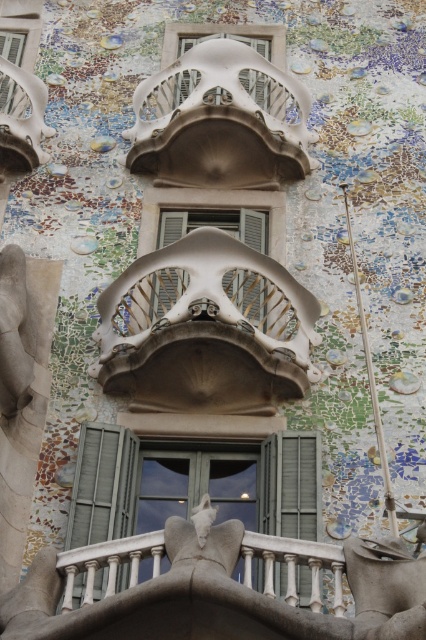
You are standing in front of Casa Batll? at Barcelona and want to take a photo of the point at coordinate point (83, 460). If your camera can only focus on objects within 50 meters, will you be able to capture the point clearly?

The point at coordinate point (83, 460) is 57.75 meters away from the camera, which is beyond the camera focus range of 50 meters. Therefore, the point cannot be captured clearly.

You are an architect visiting Casa Batll? looking at the facade. You notice two central elements, the matte white balcony at center and the matte glass window at center. From your vantage point, which one is located to the right?

The matte glass window at center is located to the right of the matte white balcony at center.